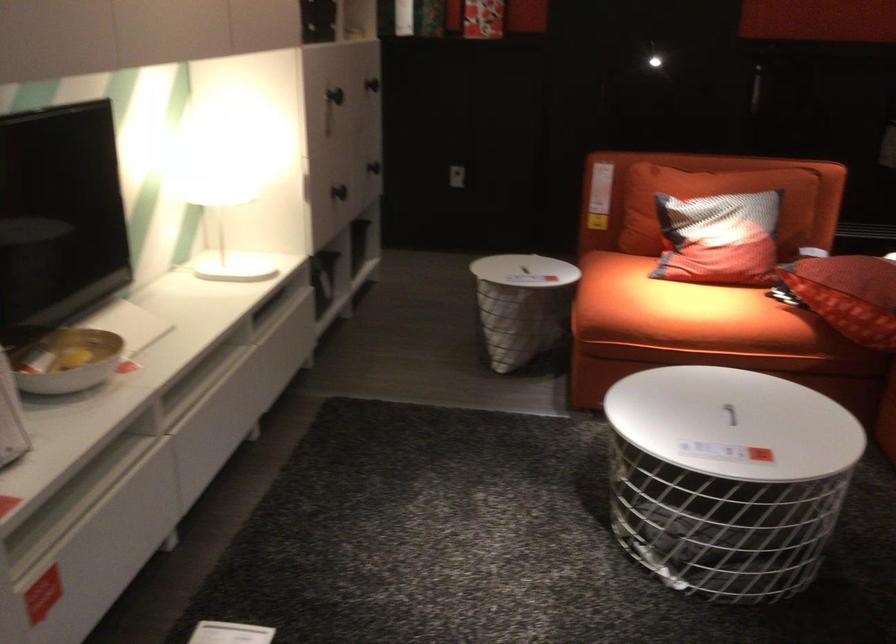
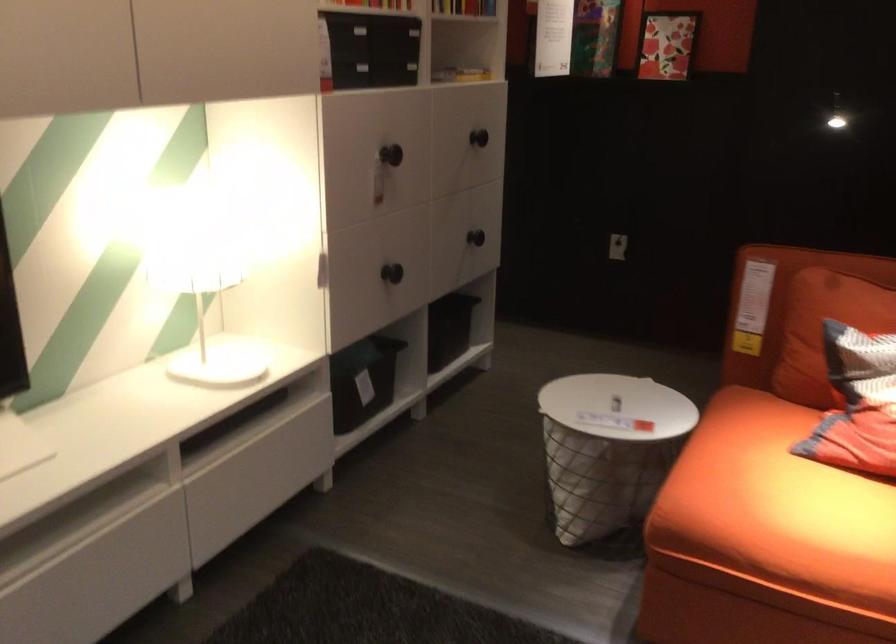
Consider the image. The images are taken continuously from a first-person perspective. In which direction are you moving?

The cameraman moved toward right, forward.